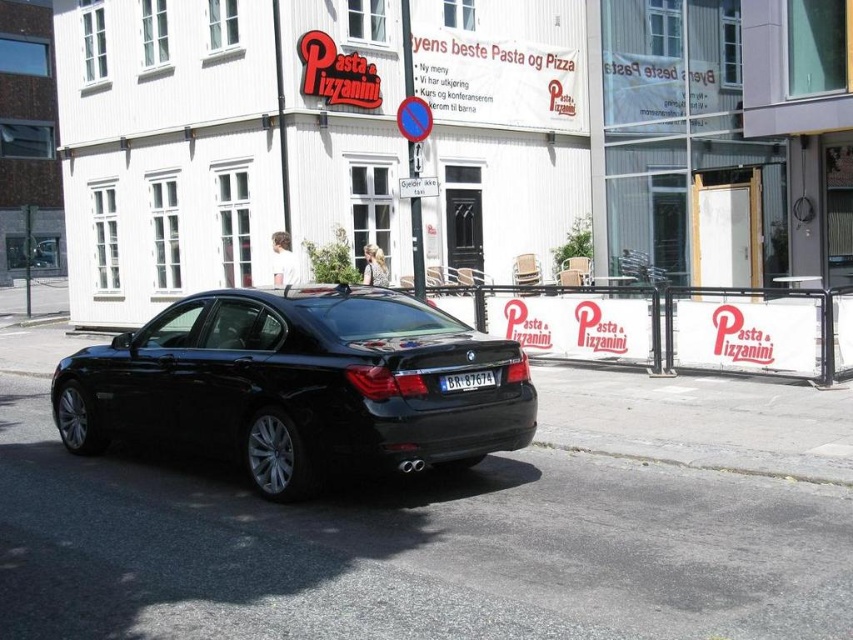
Question: Which object is positioned closest to the black metallic car at center?

Choices:
 (A) black plastic license plate at center
 (B) white plastic barrier at center

Answer: (A)

Question: Which point is farther from the camera taking this photo?

Choices:
 (A) [x=758, y=362]
 (B) [x=207, y=369]
 (C) [x=488, y=385]

Answer: (A)

Question: Is black metallic car at center wider than black plastic license plate at center?

Choices:
 (A) no
 (B) yes

Answer: (B)

Question: Observing the image, what is the correct spatial positioning of black metallic car at center in reference to white plastic barrier at center?

Choices:
 (A) right
 (B) left

Answer: (B)

Question: Considering the real-world distances, which object is closest to the white plastic barrier at center?

Choices:
 (A) black plastic license plate at center
 (B) black metallic car at center

Answer: (A)

Question: Can you confirm if white plastic barrier at center is thinner than black plastic license plate at center?

Choices:
 (A) no
 (B) yes

Answer: (A)